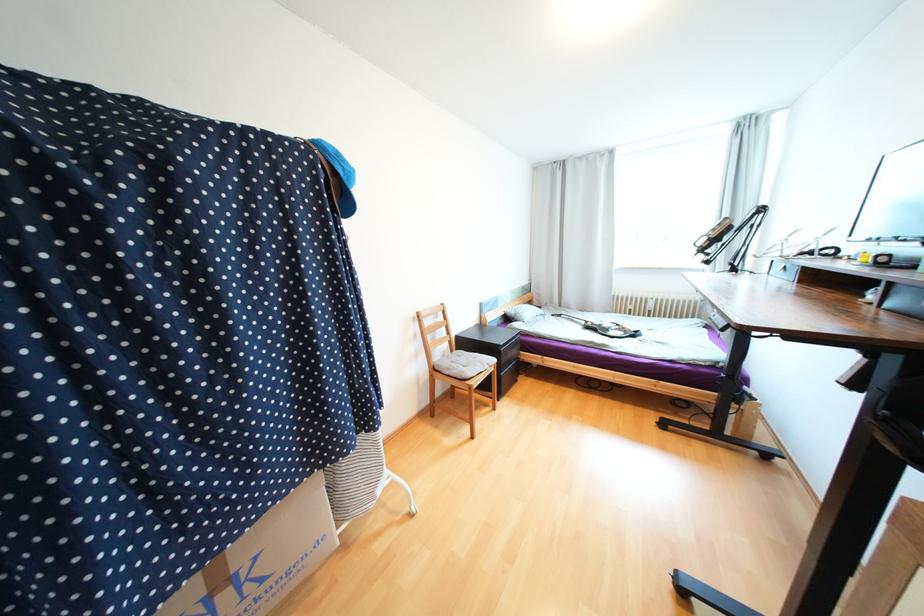
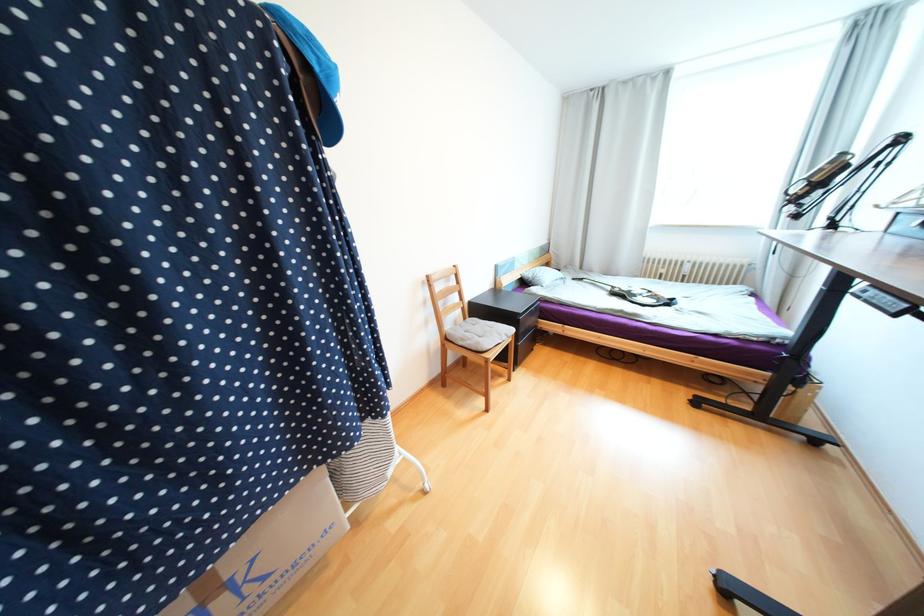
Question: What movement of the cameraman would produce the second image?

Choices:
 (A) Left
 (B) Right
 (C) Forward
 (D) Backward

Answer: (C)